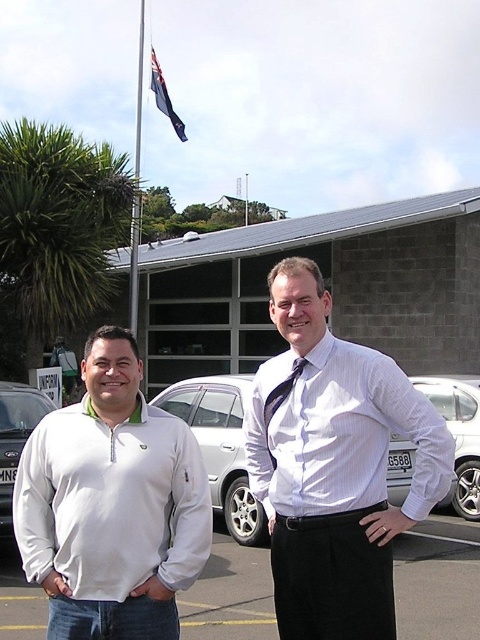
You are a photographer positioned at the back of the parking lot. You want to take a photo that includes both the white fleece at center and the silver metallic sedan at center. Which object should you focus on first to ensure both are in clear focus?

The white fleece at center is closer to the viewer than the silver metallic sedan at center. To ensure both are in clear focus, you should focus on the white fleece at center first, as it is closer, and the sedan will fall within the depth of field if focused properly on the nearer object.